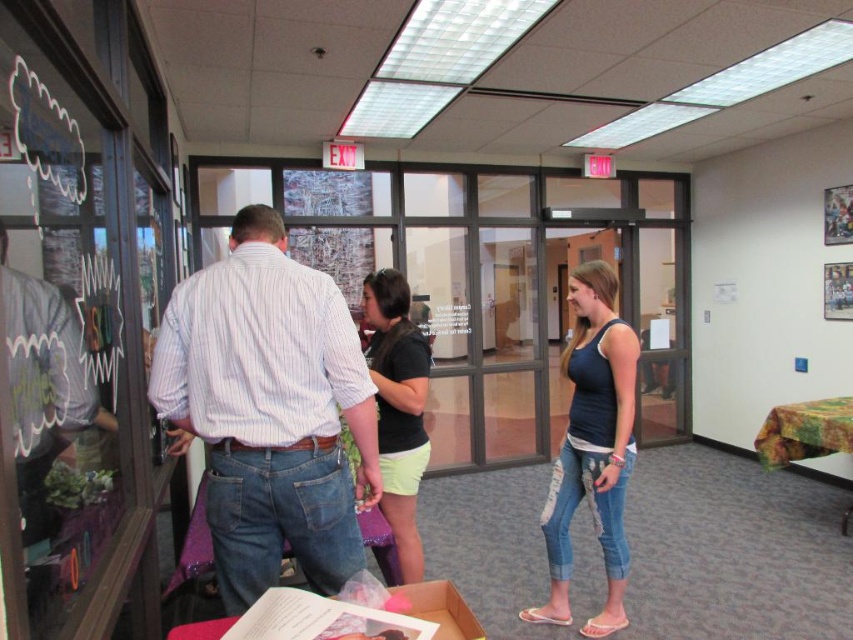
Between black matte shirt at center and cardboard box at center, which one has less height?

cardboard box at center

Does black matte shirt at center have a larger size compared to cardboard box at center?

Yes, black matte shirt at center is bigger than cardboard box at center.

Is point (381, 369) positioned before point (424, 580)?

No, it is behind (424, 580).

At what (x,y) coordinates should I click in order to perform the action: click on black matte shirt at center. Please return your answer as a coordinate pair (x, y). The width and height of the screenshot is (853, 640). Looking at the image, I should click on (398, 406).

Does denim patchwork jeans at center appear on the left side of cardboard box at center?

Incorrect, denim patchwork jeans at center is not on the left side of cardboard box at center.

Looking at this image, does denim patchwork jeans at center have a smaller size compared to cardboard box at center?

No.

Which is in front, point (631, 332) or point (431, 616)?

Point (431, 616) is in front.

Find the location of a particular element. This screenshot has height=640, width=853. denim patchwork jeans at center is located at coordinates (592, 448).

Is brushed metal shirt at left wider than black matte shirt at center?

In fact, brushed metal shirt at left might be narrower than black matte shirt at center.

Is brushed metal shirt at left closer to camera compared to black matte shirt at center?

Yes, brushed metal shirt at left is in front of black matte shirt at center.

You are a GUI agent. You are given a task and a screenshot of the screen. Output one action in this format:
    pyautogui.click(x=<x>, y=<y>)
    Task: Click on the brushed metal shirt at left
    The height and width of the screenshot is (640, 853).
    Given the screenshot: What is the action you would take?
    pyautogui.click(x=44, y=387)